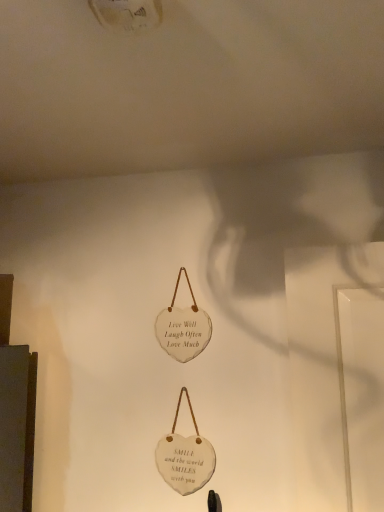
Describe the element at coordinates (185, 457) in the screenshot. I see `white stone heart at center, the 2th handbag viewed from the top` at that location.

Find the location of a particular element. white stone heart at center, the 2th handbag viewed from the top is located at coordinates (185, 457).

In order to face white stone heart at center, the 2th handbag viewed from the top, should I rotate leftwards or rightwards?

Turn left by 1.309 degrees to look at white stone heart at center, the 2th handbag viewed from the top.

How much space does white stone heart at center, which is the first handbag in top-to-bottom order, occupy vertically?

white stone heart at center, which is the first handbag in top-to-bottom order, is 30.49 centimeters tall.

What do you see at coordinates (183, 328) in the screenshot? This screenshot has width=384, height=512. I see `white stone heart at center, which is the first handbag in top-to-bottom order` at bounding box center [183, 328].

Where is `white stone heart at center, the 2th handbag positioned from the bottom`? white stone heart at center, the 2th handbag positioned from the bottom is located at coordinates [183, 328].

The width and height of the screenshot is (384, 512). In order to click on white stone heart at center, the 2th handbag viewed from the top in this screenshot , I will do `click(185, 457)`.

Looking at this image, considering the relative positions of white stone heart at center, which is the first handbag in top-to-bottom order, and white stone heart at center, the 2th handbag viewed from the top, in the image provided, is white stone heart at center, which is the first handbag in top-to-bottom order, to the left of white stone heart at center, the 2th handbag viewed from the top, from the viewer's perspective?

Indeed, white stone heart at center, which is the first handbag in top-to-bottom order, is positioned on the left side of white stone heart at center, the 2th handbag viewed from the top.

Which object is more forward, white stone heart at center, the 2th handbag positioned from the bottom, or white stone heart at center, the 2th handbag viewed from the top?

white stone heart at center, the 2th handbag viewed from the top.

Considering the points (163, 334) and (168, 470), which point is behind, point (163, 334) or point (168, 470)?

Point (163, 334)

Consider the image. From the image's perspective, between white stone heart at center, the 2th handbag positioned from the bottom, and white stone heart at center, arranged as the first handbag when ordered from the bottom, who is located below?

white stone heart at center, arranged as the first handbag when ordered from the bottom, appears lower in the image.

From a real-world perspective, is white stone heart at center, which is the first handbag in top-to-bottom order, physically above white stone heart at center, the 2th handbag viewed from the top?

Yes, from a real-world perspective, white stone heart at center, which is the first handbag in top-to-bottom order, is over white stone heart at center, the 2th handbag viewed from the top

Considering the relative sizes of white stone heart at center, which is the first handbag in top-to-bottom order, and white stone heart at center, arranged as the first handbag when ordered from the bottom, in the image provided, is white stone heart at center, which is the first handbag in top-to-bottom order, thinner than white stone heart at center, arranged as the first handbag when ordered from the bottom,?

No.

Who is shorter, white stone heart at center, which is the first handbag in top-to-bottom order, or white stone heart at center, the 2th handbag viewed from the top?

With less height is white stone heart at center, the 2th handbag viewed from the top.

Who is bigger, white stone heart at center, which is the first handbag in top-to-bottom order, or white stone heart at center, arranged as the first handbag when ordered from the bottom?

Bigger between the two is white stone heart at center, which is the first handbag in top-to-bottom order.

Is white stone heart at center, which is the first handbag in top-to-bottom order, surrounding white stone heart at center, the 2th handbag viewed from the top?

Actually, white stone heart at center, the 2th handbag viewed from the top, is outside white stone heart at center, which is the first handbag in top-to-bottom order.

From the picture: Can you see white stone heart at center, the 2th handbag positioned from the bottom, touching white stone heart at center, arranged as the first handbag when ordered from the bottom?

No, white stone heart at center, the 2th handbag positioned from the bottom, is not making contact with white stone heart at center, arranged as the first handbag when ordered from the bottom.

In the scene shown: Is white stone heart at center, which is the first handbag in top-to-bottom order, oriented towards white stone heart at center, arranged as the first handbag when ordered from the bottom?

No, white stone heart at center, which is the first handbag in top-to-bottom order, is not oriented towards white stone heart at center, arranged as the first handbag when ordered from the bottom.

From the picture: How different are the orientations of white stone heart at center, the 2th handbag positioned from the bottom, and white stone heart at center, arranged as the first handbag when ordered from the bottom, in degrees?

The angle between the facing direction of white stone heart at center, the 2th handbag positioned from the bottom, and the facing direction of white stone heart at center, arranged as the first handbag when ordered from the bottom, is 0.469 degrees.

Looking at this image, measure the distance from white stone heart at center, which is the first handbag in top-to-bottom order, to white stone heart at center, the 2th handbag viewed from the top.

A distance of 9.26 inches exists between white stone heart at center, which is the first handbag in top-to-bottom order, and white stone heart at center, the 2th handbag viewed from the top.

Identify the location of handbag above the white stone heart at center, arranged as the first handbag when ordered from the bottom (from the image's perspective). (183, 328).

From the picture: Is white stone heart at center, arranged as the first handbag when ordered from the bottom, to the right of white stone heart at center, the 2th handbag positioned from the bottom, from the viewer's perspective?

Indeed, white stone heart at center, arranged as the first handbag when ordered from the bottom, is positioned on the right side of white stone heart at center, the 2th handbag positioned from the bottom.

Considering their positions, is white stone heart at center, the 2th handbag viewed from the top, located in front of or behind white stone heart at center, which is the first handbag in top-to-bottom order?

In the image, white stone heart at center, the 2th handbag viewed from the top, appears in front of white stone heart at center, which is the first handbag in top-to-bottom order.

Is point (191, 465) more distant than point (163, 339)?

No, it is in front of (163, 339).

From the image's perspective, does white stone heart at center, arranged as the first handbag when ordered from the bottom, appear higher than white stone heart at center, which is the first handbag in top-to-bottom order?

No, from the image's perspective, white stone heart at center, arranged as the first handbag when ordered from the bottom, is not above white stone heart at center, which is the first handbag in top-to-bottom order.

From a real-world perspective, between white stone heart at center, the 2th handbag viewed from the top, and white stone heart at center, which is the first handbag in top-to-bottom order, who is vertically lower?

white stone heart at center, the 2th handbag viewed from the top, from a real-world perspective.

Between white stone heart at center, arranged as the first handbag when ordered from the bottom, and white stone heart at center, which is the first handbag in top-to-bottom order, which one has larger width?

white stone heart at center, which is the first handbag in top-to-bottom order.

Is white stone heart at center, the 2th handbag viewed from the top, taller or shorter than white stone heart at center, the 2th handbag positioned from the bottom?

In the image, white stone heart at center, the 2th handbag viewed from the top, appears to be shorter than white stone heart at center, the 2th handbag positioned from the bottom.

Can you confirm if white stone heart at center, arranged as the first handbag when ordered from the bottom, is smaller than white stone heart at center, which is the first handbag in top-to-bottom order?

Correct, white stone heart at center, arranged as the first handbag when ordered from the bottom, occupies less space than white stone heart at center, which is the first handbag in top-to-bottom order.

Does white stone heart at center, the 2th handbag viewed from the top, contain white stone heart at center, which is the first handbag in top-to-bottom order?

No.

Is white stone heart at center, the 2th handbag viewed from the top, far from white stone heart at center, which is the first handbag in top-to-bottom order?

Actually, white stone heart at center, the 2th handbag viewed from the top, and white stone heart at center, which is the first handbag in top-to-bottom order, are a little close together.

Is white stone heart at center, arranged as the first handbag when ordered from the bottom, oriented away from white stone heart at center, which is the first handbag in top-to-bottom order?

That's not correct — white stone heart at center, arranged as the first handbag when ordered from the bottom, is not looking away from white stone heart at center, which is the first handbag in top-to-bottom order.

How many degrees apart are the facing directions of white stone heart at center, arranged as the first handbag when ordered from the bottom, and white stone heart at center, the 2th handbag positioned from the bottom?

white stone heart at center, arranged as the first handbag when ordered from the bottom, and white stone heart at center, the 2th handbag positioned from the bottom, are facing 0.469 degrees away from each other.

The image size is (384, 512). What are the coordinates of `handbag located underneath the white stone heart at center, which is the first handbag in top-to-bottom order (from a real-world perspective)` in the screenshot? It's located at (185, 457).

At what (x,y) coordinates should I click in order to perform the action: click on handbag to the right of white stone heart at center, which is the first handbag in top-to-bottom order. Please return your answer as a coordinate pair (x, y). The height and width of the screenshot is (512, 384). Looking at the image, I should click on (185, 457).

Where is `handbag in front of the white stone heart at center, the 2th handbag positioned from the bottom`? handbag in front of the white stone heart at center, the 2th handbag positioned from the bottom is located at coordinates (185, 457).